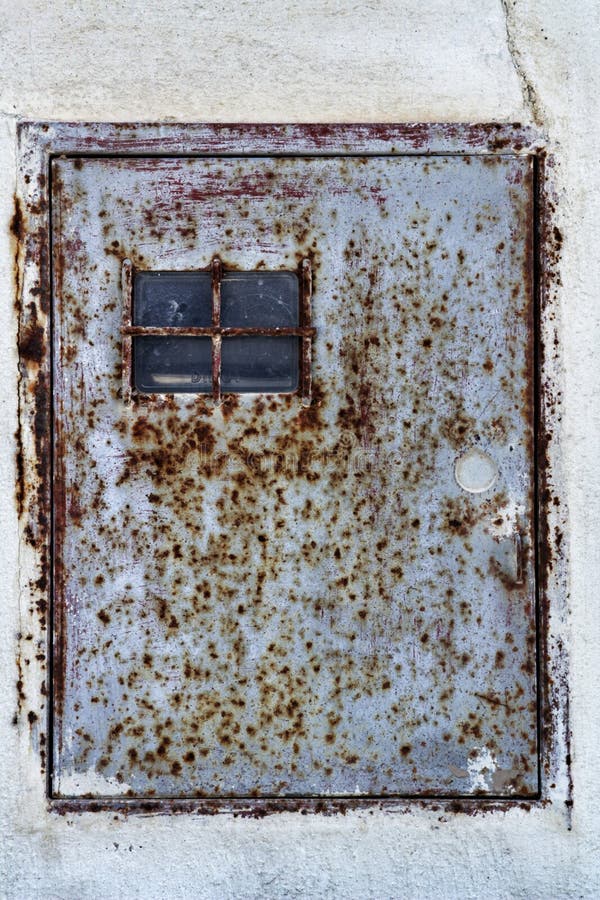
The width and height of the screenshot is (600, 900). In order to click on textured wall in this screenshot , I will do `click(329, 61)`.